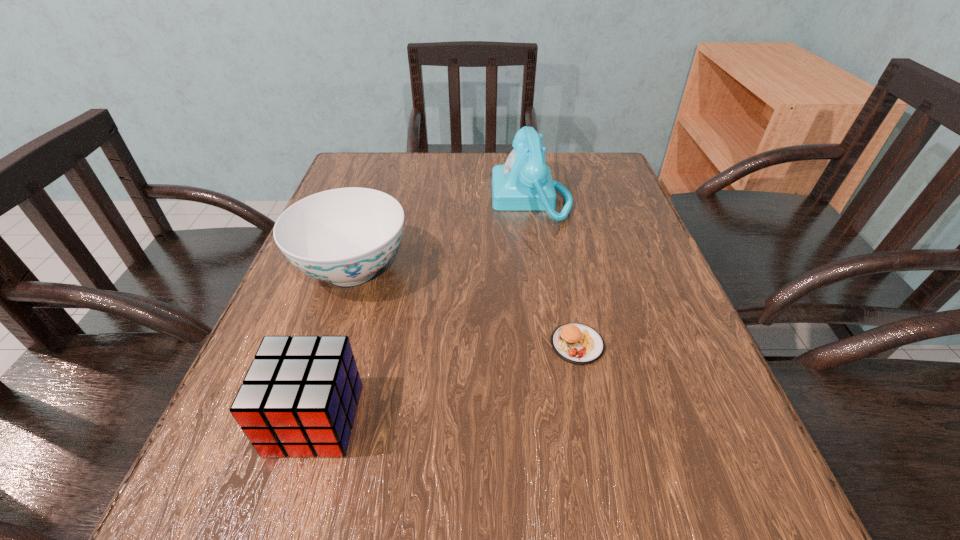
In the image, there is a desktop. In order to click on vacant space at the left edge in this screenshot , I will do `click(353, 349)`.

This screenshot has width=960, height=540. In the image, there is a desktop. What are the coordinates of `vacant space at the right edge` in the screenshot? It's located at (666, 305).

Where is `vacant space at the far left corner of the desktop`? The height and width of the screenshot is (540, 960). vacant space at the far left corner of the desktop is located at coordinates (395, 170).

The height and width of the screenshot is (540, 960). In order to click on vacant region at the near left corner of the desktop in this screenshot , I will do `click(264, 490)`.

In the image, there is a desktop. In order to click on vacant space at the far right corner in this screenshot , I will do `click(571, 170)`.

This screenshot has height=540, width=960. Find the location of `empty space between the cube and the tallest object`. empty space between the cube and the tallest object is located at coordinates (423, 309).

Locate an element on the screen. This screenshot has height=540, width=960. free space between the chinaware and the patty is located at coordinates (465, 307).

Locate an element on the screen. This screenshot has width=960, height=540. vacant space that is in between the patty and the nearest object is located at coordinates (446, 382).

This screenshot has width=960, height=540. I want to click on free space between the chinaware and the shortest object, so click(465, 307).

Locate an element on the screen. Image resolution: width=960 pixels, height=540 pixels. free space between the shortest object and the third nearest object is located at coordinates (465, 307).